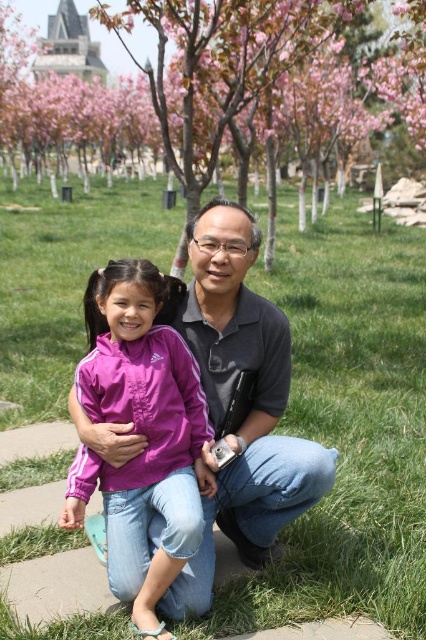
Question: Which point is farther to the camera?

Choices:
 (A) green grass at center
 (B) pink fabric jacket at center

Answer: (A)

Question: Which point is farther to the camera?

Choices:
 (A) pink blossoms at upper center
 (B) pink fabric jacket at center

Answer: (A)

Question: Does green grass at center have a smaller size compared to pink blossoms at upper center?

Choices:
 (A) yes
 (B) no

Answer: (A)

Question: Is pink blossoms at upper center wider than pink fabric jacket at center?

Choices:
 (A) no
 (B) yes

Answer: (B)

Question: Which object appears closest to the camera in this image?

Choices:
 (A) green grass at center
 (B) pink blossoms at upper center
 (C) pink fabric jacket at center

Answer: (C)

Question: Does pink blossoms at upper center have a greater width compared to pink fabric jacket at center?

Choices:
 (A) no
 (B) yes

Answer: (B)